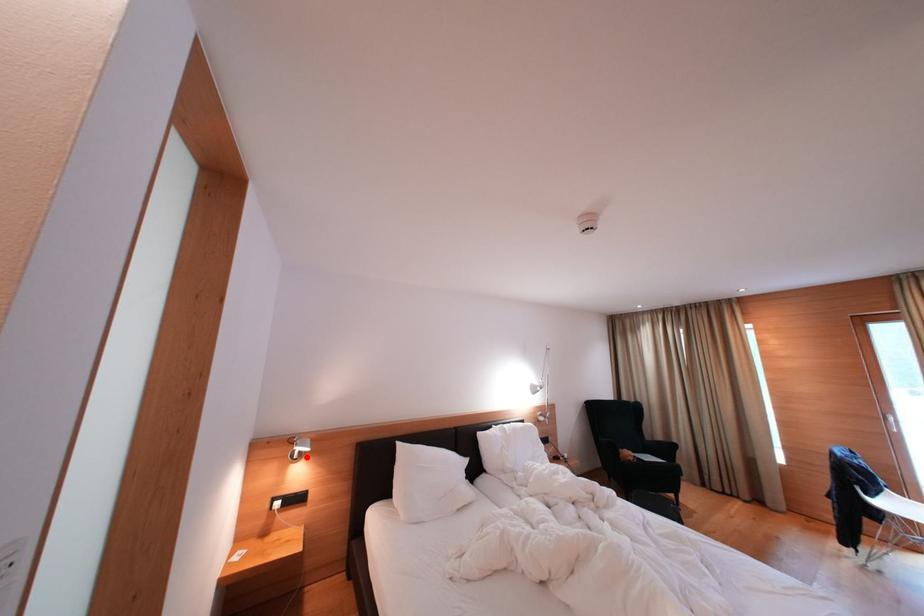
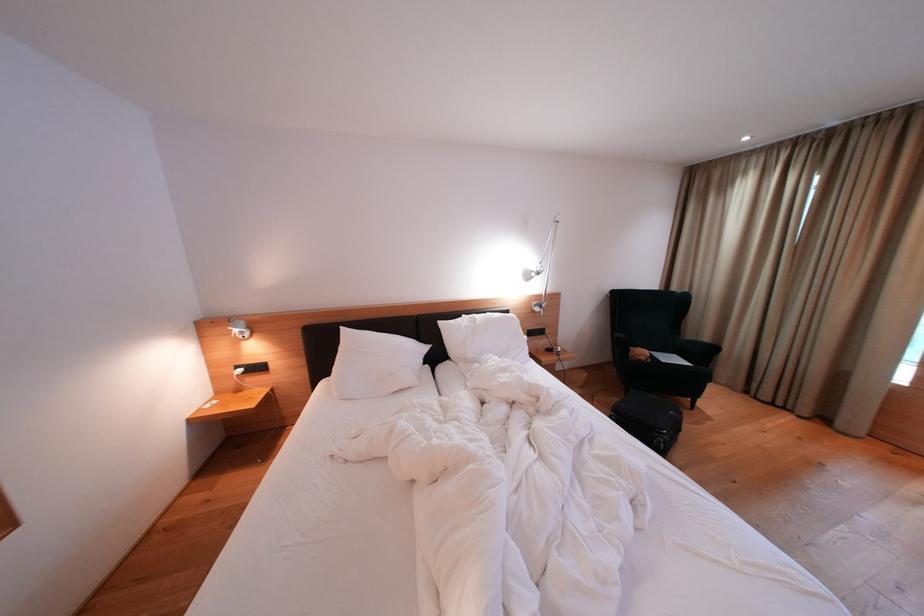
Question: I am providing you with two images of the same scene from different viewpoints. In image1, a red point is highlighted. Considering the same 3D point in image2, which of the following is correct?

Choices:
 (A) It is closer
 (B) It is farther

Answer: (A)